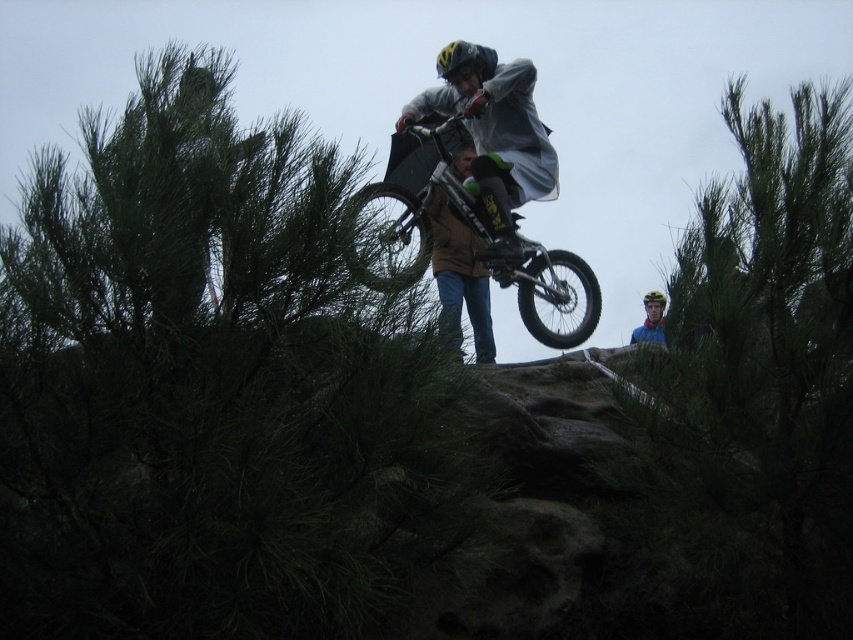
Between shiny black mountain bike at center and yellow matte helmet at upper center, which one has more height?

Standing taller between the two is shiny black mountain bike at center.

Does point (347, 230) come farther from viewer compared to point (657, 332)?

No, (347, 230) is closer to viewer.

Locate an element on the screen. This screenshot has width=853, height=640. shiny black mountain bike at center is located at coordinates (408, 209).

Identify the location of shiny black mountain bike at center. The width and height of the screenshot is (853, 640). (408, 209).

Does green leafy tree at upper left come behind shiny black mountain bike at center?

No, green leafy tree at upper left is in front of shiny black mountain bike at center.

Is point (424, 396) positioned in front of point (544, 275)?

Yes, point (424, 396) is in front of point (544, 275).

Where is `green leafy tree at upper left`? The image size is (853, 640). green leafy tree at upper left is located at coordinates (212, 388).

Can you confirm if green leafy tree at upper center is taller than yellow matte helmet at upper center?

Indeed, green leafy tree at upper center has a greater height compared to yellow matte helmet at upper center.

Does green leafy tree at upper center have a greater width compared to yellow matte helmet at upper center?

Indeed, green leafy tree at upper center has a greater width compared to yellow matte helmet at upper center.

Which is behind, point (712, 323) or point (631, 333)?

The point (631, 333) is behind.

The width and height of the screenshot is (853, 640). In order to click on green leafy tree at upper center in this screenshot , I will do `click(751, 396)`.